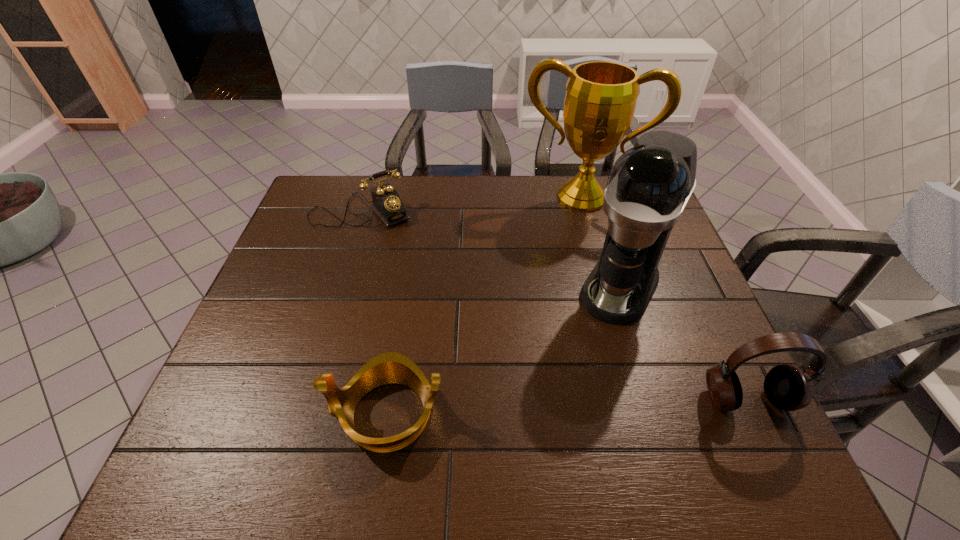
Locate an element on the screen. The image size is (960, 540). tiara is located at coordinates (390, 367).

You are a GUI agent. You are given a task and a screenshot of the screen. Output one action in this format:
    pyautogui.click(x=<x>, y=<y>)
    Task: Click on the third shortest object
    The width and height of the screenshot is (960, 540).
    Given the screenshot: What is the action you would take?
    pyautogui.click(x=787, y=387)

Where is `the third nearest object`? the third nearest object is located at coordinates click(649, 185).

Identify the location of telephone. (387, 204).

Identify the location of award. The height and width of the screenshot is (540, 960). 601,96.

Locate an element on the screen. This screenshot has width=960, height=540. free space located at the front emblem of the tiara is located at coordinates (294, 414).

Locate an element on the screen. The width and height of the screenshot is (960, 540). vacant space located 0.210m at the front emblem of the tiara is located at coordinates (x=226, y=414).

This screenshot has height=540, width=960. I want to click on vacant space located 0.130m at the front emblem of the tiara, so click(x=264, y=414).

I want to click on vacant space positioned place cup under the spout of the third nearest object, so click(565, 389).

Locate an element on the screen. This screenshot has height=540, width=960. free spot located place cup under the spout of the third nearest object is located at coordinates (592, 341).